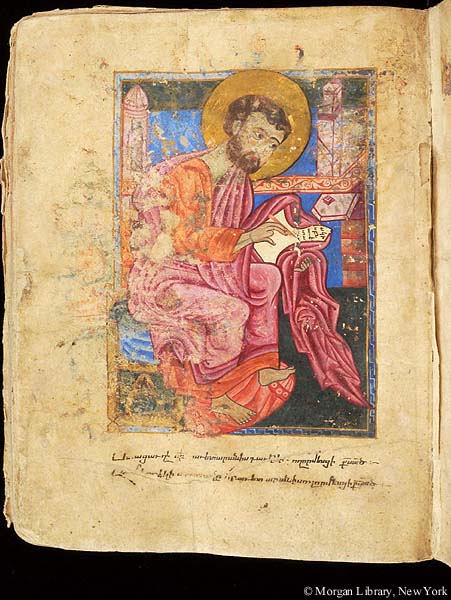
Find the location of `picture`. picture is located at coordinates (259, 248).